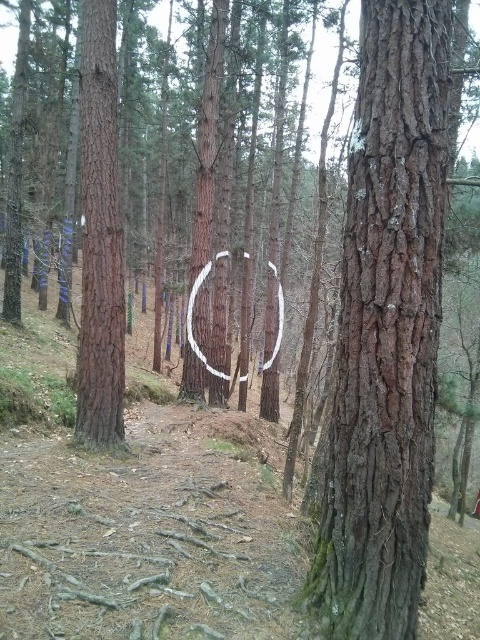
At what (x,y) coordinates should I click in order to perform the action: click on smooth brown bark at center. Please return your answer as a coordinate pair (x, y). This screenshot has width=480, height=640. Looking at the image, I should click on (385, 332).

Is smooth brown bark at center bigger than brown rough tree trunk at left?

No, smooth brown bark at center is not bigger than brown rough tree trunk at left.

This screenshot has width=480, height=640. I want to click on smooth brown bark at center, so click(385, 332).

Is smooth brown bark at center thinner than white painted wood horseshoe at center?

Yes.

Consider the image. How much distance is there between smooth brown bark at center and white painted wood horseshoe at center?

smooth brown bark at center and white painted wood horseshoe at center are 7.62 meters apart.

Find the location of `smooth brown bark at center`. smooth brown bark at center is located at coordinates point(385,332).

Is brown rough tree trunk at left positioned in front of white painted wood horseshoe at center?

Yes, it is.

How much distance is there between brown rough tree trunk at left and white painted wood horseshoe at center?

They are 5.97 meters apart.

Where is `brown rough tree trunk at left`? brown rough tree trunk at left is located at coordinates (99, 237).

The image size is (480, 640). Identify the location of brown rough tree trunk at left. (99, 237).